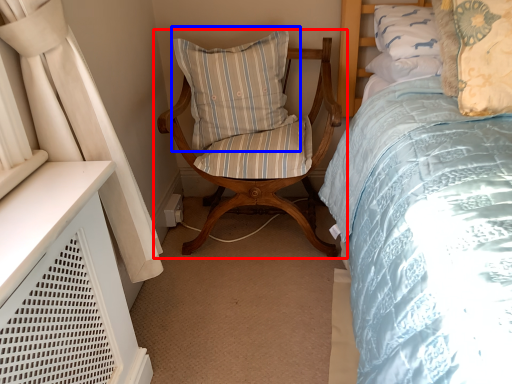
Question: Which object is further to the camera taking this photo, chair (highlighted by a red box) or pillow (highlighted by a blue box)?

Choices:
 (A) chair
 (B) pillow

Answer: (B)